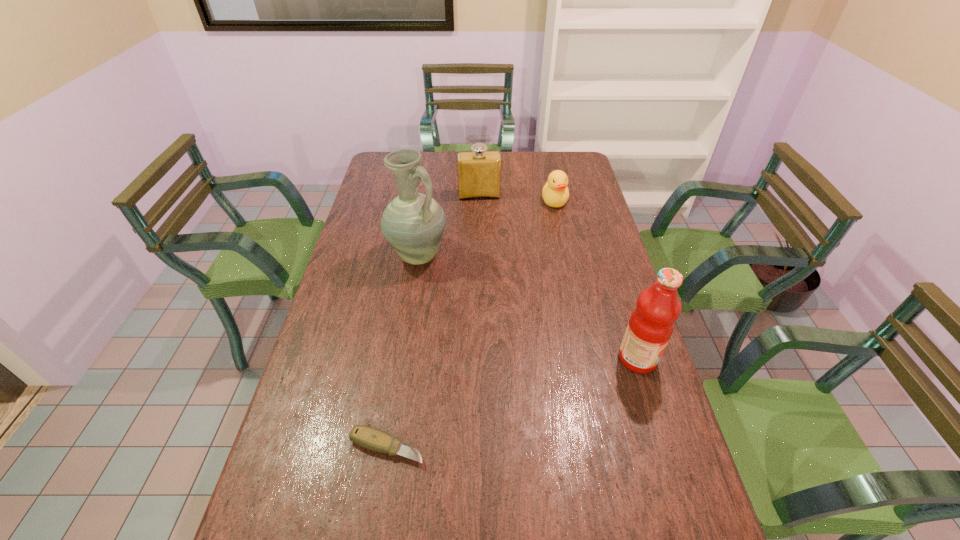
At what (x,y) coordinates should I click in order to perform the action: click on free region located 0.370m on the right of the nearest object. Please return your answer as a coordinate pair (x, y). The image size is (960, 540). Looking at the image, I should click on (583, 448).

Locate an element on the screen. vacant space located on the front-facing side of the perfume is located at coordinates 488,263.

Find the location of a particular element. free location located 0.090m on the front-facing side of the perfume is located at coordinates (482, 214).

Where is `vacant area situated 0.090m on the front-facing side of the perfume`? This screenshot has height=540, width=960. vacant area situated 0.090m on the front-facing side of the perfume is located at coordinates (482, 214).

You are a GUI agent. You are given a task and a screenshot of the screen. Output one action in this format:
    pyautogui.click(x=<x>, y=<y>)
    Task: Click on the free space located 0.270m at the beak of the duck
    Image resolution: width=960 pixels, height=540 pixels.
    Given the screenshot: What is the action you would take?
    pyautogui.click(x=555, y=258)

Locate an element on the screen. Image resolution: width=960 pixels, height=540 pixels. vacant region located 0.330m at the beak of the duck is located at coordinates (555, 269).

Where is `vacant position located at the beak of the duck`? vacant position located at the beak of the duck is located at coordinates (555, 280).

The height and width of the screenshot is (540, 960). I want to click on free region located 0.060m on the handle side of the third farthest object, so 436,286.

Where is `vacant space located on the handle side of the third farthest object`? vacant space located on the handle side of the third farthest object is located at coordinates pyautogui.click(x=444, y=298).

Find the location of a particular element. The height and width of the screenshot is (540, 960). vacant space located 0.360m on the handle side of the third farthest object is located at coordinates (477, 354).